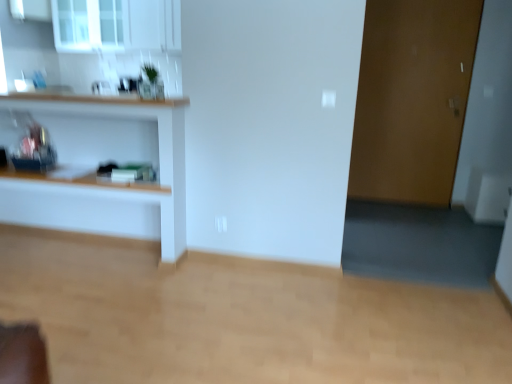
Question: Does transparent glass window at upper left have a larger size compared to wooden shelf at left?

Choices:
 (A) no
 (B) yes

Answer: (A)

Question: From a real-world perspective, is transparent glass window at upper left positioned under wooden shelf at left based on gravity?

Choices:
 (A) no
 (B) yes

Answer: (A)

Question: Is transparent glass window at upper left thinner than wooden shelf at left?

Choices:
 (A) no
 (B) yes

Answer: (B)

Question: Does transparent glass window at upper left appear on the right side of wooden shelf at left?

Choices:
 (A) yes
 (B) no

Answer: (B)

Question: Is transparent glass window at upper left surrounding wooden shelf at left?

Choices:
 (A) no
 (B) yes

Answer: (A)

Question: Considering their positions, is wooden shelf at left located in front of or behind brown matte door at right?

Choices:
 (A) front
 (B) behind

Answer: (A)

Question: From a real-world perspective, is wooden shelf at left above or below brown matte door at right?

Choices:
 (A) below
 (B) above

Answer: (A)

Question: Is wooden shelf at left situated inside brown matte door at right or outside?

Choices:
 (A) outside
 (B) inside

Answer: (A)

Question: From their relative heights in the image, would you say wooden shelf at left is taller or shorter than brown matte door at right?

Choices:
 (A) short
 (B) tall

Answer: (A)

Question: Choose the correct answer: Is brown matte door at right inside transparent glass window at upper left or outside it?

Choices:
 (A) inside
 (B) outside

Answer: (B)

Question: Is brown matte door at right bigger or smaller than transparent glass window at upper left?

Choices:
 (A) big
 (B) small

Answer: (B)

Question: From a real-world perspective, is brown matte door at right positioned above or below transparent glass window at upper left?

Choices:
 (A) below
 (B) above

Answer: (A)

Question: Is point (409, 148) positioned closer to the camera than point (110, 1)?

Choices:
 (A) closer
 (B) farther

Answer: (B)

Question: From the image's perspective, relative to wooden shelf at left, is transparent glass window at upper left above or below?

Choices:
 (A) below
 (B) above

Answer: (B)

Question: Is transparent glass window at upper left in front of or behind wooden shelf at left in the image?

Choices:
 (A) front
 (B) behind

Answer: (B)